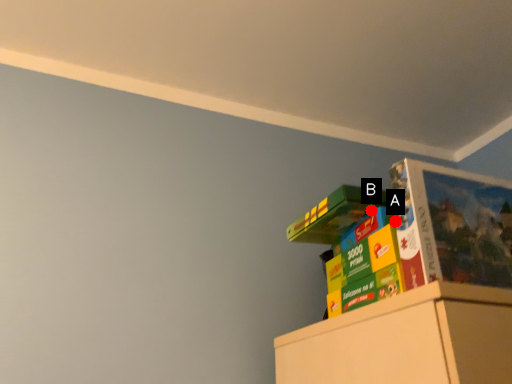
Question: Two points are circled on the image, labeled by A and B beside each circle. Among these points, which one is farthest from the camera?

Choices:
 (A) A is further
 (B) B is further

Answer: (B)